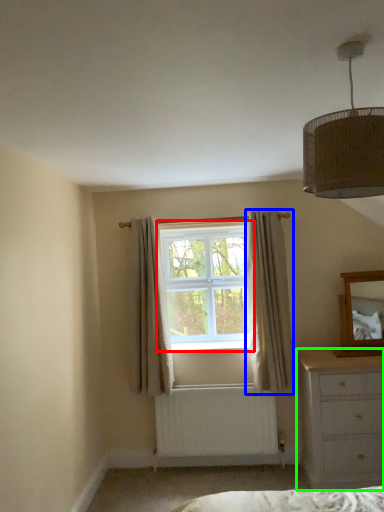
Question: Based on their relative distances, which object is farther from window (highlighted by a red box)? Choose from curtain (highlighted by a blue box) and chest of drawers (highlighted by a green box).

Choices:
 (A) curtain
 (B) chest of drawers

Answer: (B)